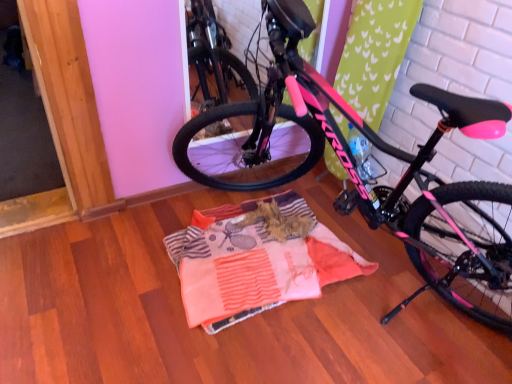
You are a GUI agent. You are given a task and a screenshot of the screen. Output one action in this format:
    pyautogui.click(x=<x>, y=<y>)
    Task: Click on the vacant space to the left of striped cotton blanket at center
    The image size is (512, 384).
    Given the screenshot: What is the action you would take?
    pyautogui.click(x=102, y=272)